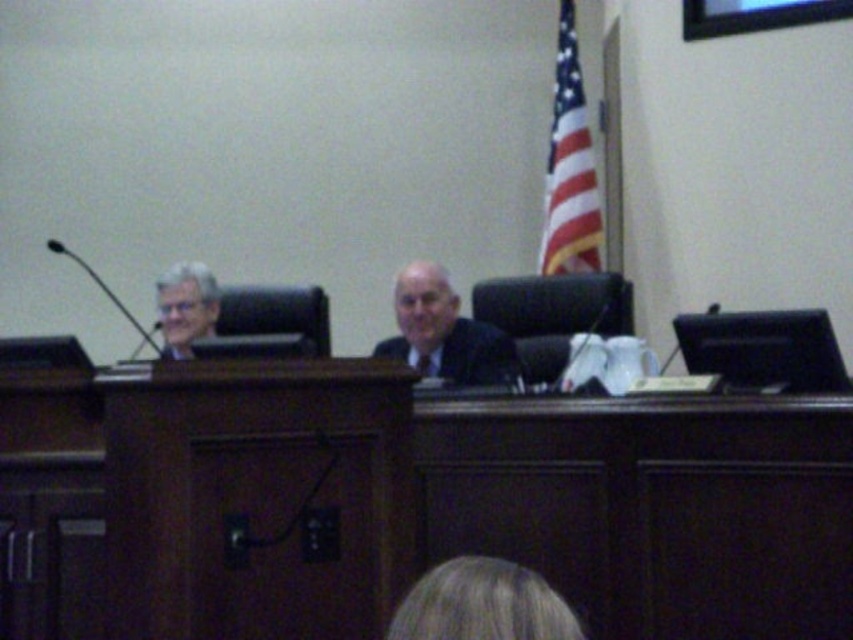
Question: Which of the following is the farthest from the observer?

Choices:
 (A) matte black suit at left
 (B) matte black suit at center
 (C) blonde hair at lower center

Answer: (A)

Question: Can you confirm if matte black suit at center is positioned to the left of matte black suit at left?

Choices:
 (A) no
 (B) yes

Answer: (A)

Question: Which is farther from the blonde hair at lower center?

Choices:
 (A) matte black suit at left
 (B) matte black suit at center

Answer: (A)

Question: Is blonde hair at lower center closer to the viewer compared to matte black suit at center?

Choices:
 (A) yes
 (B) no

Answer: (A)

Question: Can you confirm if matte black suit at center is positioned to the right of matte black suit at left?

Choices:
 (A) yes
 (B) no

Answer: (A)

Question: Which is farther from the blonde hair at lower center?

Choices:
 (A) matte black suit at center
 (B) matte black suit at left

Answer: (B)